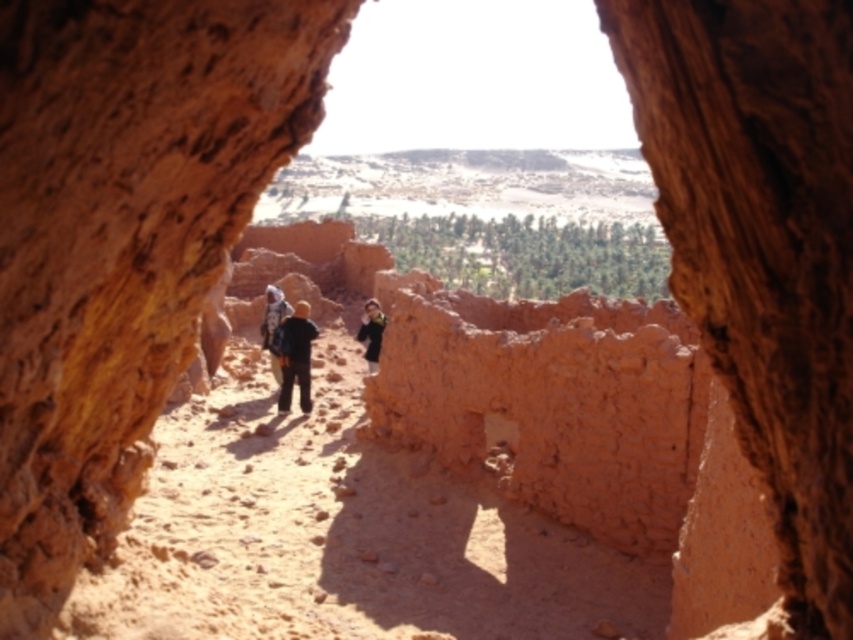
Question: Which point is farther from the camera taking this photo?

Choices:
 (A) (x=271, y=285)
 (B) (x=300, y=314)

Answer: (A)

Question: Can you confirm if dark brown leather jacket at center is smaller than matte brown backpack at center?

Choices:
 (A) no
 (B) yes

Answer: (B)

Question: In this image, where is matte brown backpack at center located relative to dark green fabric jacket at center?

Choices:
 (A) below
 (B) above

Answer: (B)

Question: Which object appears closest to the camera in this image?

Choices:
 (A) dark green fabric jacket at center
 (B) dark brown leather jacket at center

Answer: (B)

Question: Considering the real-world distances, which object is farthest from the dark brown leather jacket at center?

Choices:
 (A) dark green fabric jacket at center
 (B) matte brown backpack at center

Answer: (A)

Question: Where is dark brown leather jacket at center located in relation to matte brown backpack at center in the image?

Choices:
 (A) right
 (B) left

Answer: (A)